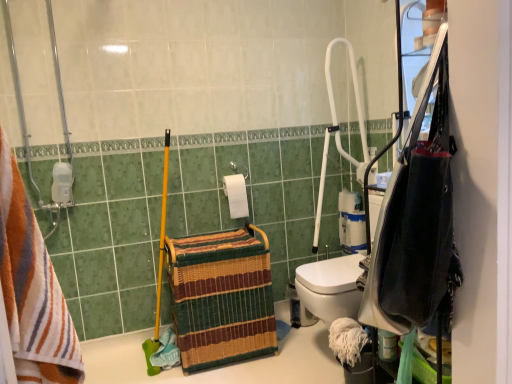
Describe the element at coordinates (339, 131) in the screenshot. I see `white plastic shower at upper right` at that location.

Describe the element at coordinates (236, 195) in the screenshot. This screenshot has height=384, width=512. I see `white matte toilet paper at center, positioned as the 2th toilet paper in right-to-left order` at that location.

Identify the location of black fabric bag at right. This screenshot has width=512, height=384. (415, 218).

The height and width of the screenshot is (384, 512). I want to click on cabinetry lying on the left of white matte toilet paper at center-right, which is the 1th toilet paper in right-to-left order, so click(415, 218).

Could you measure the distance between white matte toilet paper at center-right, arranged as the 2th toilet paper when viewed from the front, and black fabric bag at right?

5.70 feet.

In the scene shown: Considering the relative sizes of white matte toilet paper at center-right, arranged as the 2th toilet paper when viewed from the front, and black fabric bag at right in the image provided, is white matte toilet paper at center-right, arranged as the 2th toilet paper when viewed from the front, smaller than black fabric bag at right?

Yes, white matte toilet paper at center-right, arranged as the 2th toilet paper when viewed from the front, is smaller than black fabric bag at right.

Looking at this image, is white matte toilet paper at center-right, arranged as the first toilet paper when viewed from the back, thinner than black fabric bag at right?

Yes.

Is woven straw basket at center positioned before white matte toilet paper at center-right, arranged as the 2th toilet paper when viewed from the front?

Yes, the depth of woven straw basket at center is less than that of white matte toilet paper at center-right, arranged as the 2th toilet paper when viewed from the front.

Does woven straw basket at center have a lesser width compared to white matte toilet paper at center-right, arranged as the first toilet paper when viewed from the back?

Incorrect, the width of woven straw basket at center is not less than that of white matte toilet paper at center-right, arranged as the first toilet paper when viewed from the back.

From the image's perspective, between woven straw basket at center and white matte toilet paper at center-right, arranged as the first toilet paper when viewed from the back, which one is located above?

white matte toilet paper at center-right, arranged as the first toilet paper when viewed from the back, from the image's perspective.

Between woven straw basket at center and white matte toilet paper at center-right, arranged as the 2th toilet paper when viewed from the front, which one has larger size?

Bigger between the two is woven straw basket at center.

Who is taller, striped cotton towel at left or black fabric bag at right?

black fabric bag at right.

What's the angular difference between striped cotton towel at left and black fabric bag at right's facing directions?

striped cotton towel at left and black fabric bag at right are facing 36 degrees away from each other.

From the image's perspective, does striped cotton towel at left appear higher than black fabric bag at right?

No, from the image's perspective, striped cotton towel at left is not over black fabric bag at right.

Are striped cotton towel at left and black fabric bag at right far apart?

No, striped cotton towel at left is in close proximity to black fabric bag at right.

Could you measure the distance between white matte toilet paper at center-right, arranged as the first toilet paper when viewed from the back, and white plastic shower at upper right?

Answer: The distance of white matte toilet paper at center-right, arranged as the first toilet paper when viewed from the back, from white plastic shower at upper right is 14.70 inches.

In the scene shown: Which object is more forward, white matte toilet paper at center-right, arranged as the 2th toilet paper when viewed from the front, or white plastic shower at upper right?

white plastic shower at upper right is in front.

Does white matte toilet paper at center-right, arranged as the 2th toilet paper when viewed from the front, have a lesser width compared to white plastic shower at upper right?

Yes.

From the picture: Based on their sizes in the image, would you say white matte toilet paper at center-right, arranged as the 2th toilet paper when viewed from the front, is bigger or smaller than white plastic shower at upper right?

Considering their sizes, white matte toilet paper at center-right, arranged as the 2th toilet paper when viewed from the front, takes up less space than white plastic shower at upper right.

Is black fabric bag at right looking in the opposite direction of striped cotton towel at left?

That's not correct — black fabric bag at right is not looking away from striped cotton towel at left.

Is black fabric bag at right far away from striped cotton towel at left?

No, black fabric bag at right is not far from striped cotton towel at left.

Which point is more forward, (339,208) or (204,286)?

The point (204,286) is in front.

Looking at this image, considering the positions of objects white matte toilet paper at center-right, arranged as the first toilet paper when viewed from the back, and woven straw basket at center in the image provided, who is behind, white matte toilet paper at center-right, arranged as the first toilet paper when viewed from the back, or woven straw basket at center?

white matte toilet paper at center-right, arranged as the first toilet paper when viewed from the back, is further from the camera.

Looking at this image, is woven straw basket at center at the back of white matte toilet paper at center-right, which is the 1th toilet paper in right-to-left order?

white matte toilet paper at center-right, which is the 1th toilet paper in right-to-left order, does not have its back to woven straw basket at center.

From a real-world perspective, is white plastic shower at upper right positioned over white matte toilet paper at center, the first toilet paper viewed from the front, based on gravity?

Yes, from a real-world perspective, white plastic shower at upper right is over white matte toilet paper at center, the first toilet paper viewed from the front

Which object is wider, white plastic shower at upper right or white matte toilet paper at center, the first toilet paper viewed from the left?

white plastic shower at upper right is wider.

Can we say white plastic shower at upper right lies outside white matte toilet paper at center, the first toilet paper viewed from the left?

Indeed, white plastic shower at upper right is completely outside white matte toilet paper at center, the first toilet paper viewed from the left.

In order to click on toilet paper on the right of black fabric bag at right in this screenshot , I will do `click(349, 201)`.

In order to click on the 1st toilet paper located above the woven straw basket at center (from a real-world perspective) in this screenshot , I will do `click(349, 201)`.

Based on their spatial positions, is white matte toilet paper at center-right, arranged as the 2th toilet paper when viewed from the front, or black fabric bag at right further from woven straw basket at center?

The object further to woven straw basket at center is black fabric bag at right.

From the image, which object appears to be nearer to white matte toilet paper at center, the first toilet paper viewed from the left, white plastic shower at upper right or white matte toilet paper at center-right, arranged as the first toilet paper when viewed from the back?

white plastic shower at upper right is positioned closer to the anchor white matte toilet paper at center, the first toilet paper viewed from the left.

Based on their spatial positions, is woven straw basket at center or white plastic shower at upper right closer to white matte toilet paper at center, positioned as the 2th toilet paper in right-to-left order?

Among the two, woven straw basket at center is located nearer to white matte toilet paper at center, positioned as the 2th toilet paper in right-to-left order.

Which object lies further to the anchor point striped cotton towel at left, white plastic shower at upper right or woven straw basket at center?

white plastic shower at upper right is further to striped cotton towel at left.

Which object lies further to the anchor point white matte toilet paper at center, the first toilet paper viewed from the left, woven straw basket at center or black fabric bag at right?

black fabric bag at right.

When comparing their distances from black fabric bag at right, does white plastic shower at upper right or white matte toilet paper at center, the first toilet paper viewed from the left, seem closer?

white matte toilet paper at center, the first toilet paper viewed from the left, is positioned closer to the anchor black fabric bag at right.

Which object lies nearer to the anchor point woven straw basket at center, white plastic shower at upper right or striped cotton towel at left?

white plastic shower at upper right is closer to woven straw basket at center.

Which object lies further to the anchor point white plastic shower at upper right, black fabric bag at right or striped cotton towel at left?

Based on the image, striped cotton towel at left appears to be further to white plastic shower at upper right.

At what (x,y) coordinates should I click in order to perform the action: click on basket between striped cotton towel at left and white plastic shower at upper right along the z-axis. Please return your answer as a coordinate pair (x, y). Image resolution: width=512 pixels, height=384 pixels. Looking at the image, I should click on (221, 297).

Find the location of `cabinetry located between striped cotton towel at left and white matte toilet paper at center-right, arranged as the first toilet paper when viewed from the back, in the depth direction`. cabinetry located between striped cotton towel at left and white matte toilet paper at center-right, arranged as the first toilet paper when viewed from the back, in the depth direction is located at coordinates (415, 218).

At what (x,y) coordinates should I click in order to perform the action: click on cabinetry positioned between striped cotton towel at left and white matte toilet paper at center, the first toilet paper viewed from the left, from near to far. Please return your answer as a coordinate pair (x, y). Looking at the image, I should click on (415, 218).

Image resolution: width=512 pixels, height=384 pixels. Find the location of `toilet paper between black fabric bag at right and white matte toilet paper at center-right, arranged as the 2th toilet paper when viewed from the front, along the z-axis`. toilet paper between black fabric bag at right and white matte toilet paper at center-right, arranged as the 2th toilet paper when viewed from the front, along the z-axis is located at coordinates (236, 195).